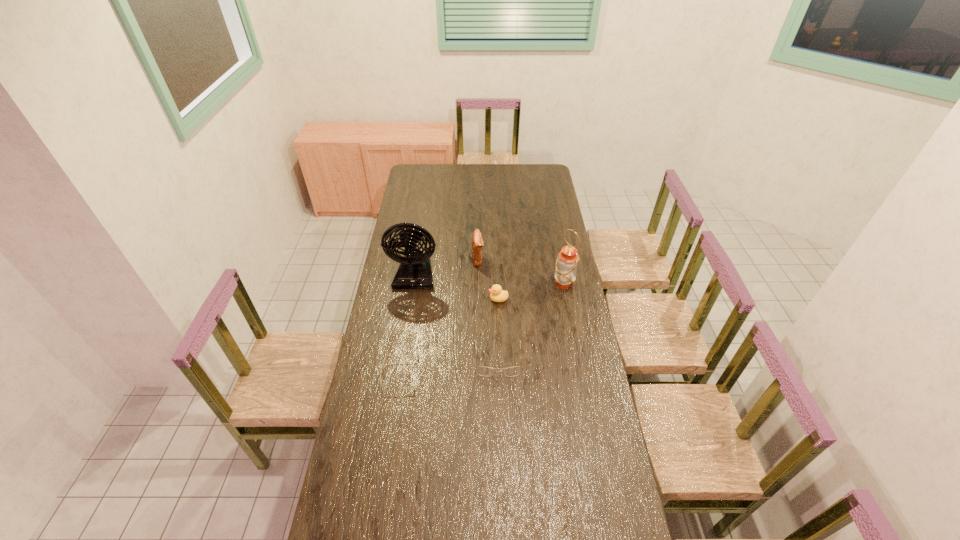
Where is `vacant position located in front of the fan to blow air`? vacant position located in front of the fan to blow air is located at coordinates (403, 355).

The width and height of the screenshot is (960, 540). I want to click on free space located on the open side of the fourth shortest object, so click(x=563, y=259).

Where is `vacant area located 0.270m on the back of the oil lamp`? vacant area located 0.270m on the back of the oil lamp is located at coordinates (555, 241).

Identify the location of vacant space located on the face of the duckling. This screenshot has width=960, height=540. (439, 299).

The height and width of the screenshot is (540, 960). What are the coordinates of `vacant space positioned 0.070m on the face of the duckling` in the screenshot? It's located at (473, 299).

Locate an element on the screen. The image size is (960, 540). vacant space positioned on the face of the duckling is located at coordinates (475, 299).

Find the location of a particular element. The height and width of the screenshot is (540, 960). spectacles that is at the left edge is located at coordinates (386, 357).

You are a GUI agent. You are given a task and a screenshot of the screen. Output one action in this format:
    pyautogui.click(x=<x>, y=<y>)
    Task: Click on the fan located in the left edge section of the desktop
    
    Given the screenshot: What is the action you would take?
    pyautogui.click(x=414, y=272)

The image size is (960, 540). Find the location of `object located in the right edge section of the desktop`. object located in the right edge section of the desktop is located at coordinates (x=567, y=260).

Where is `free space at the far edge`? free space at the far edge is located at coordinates (481, 178).